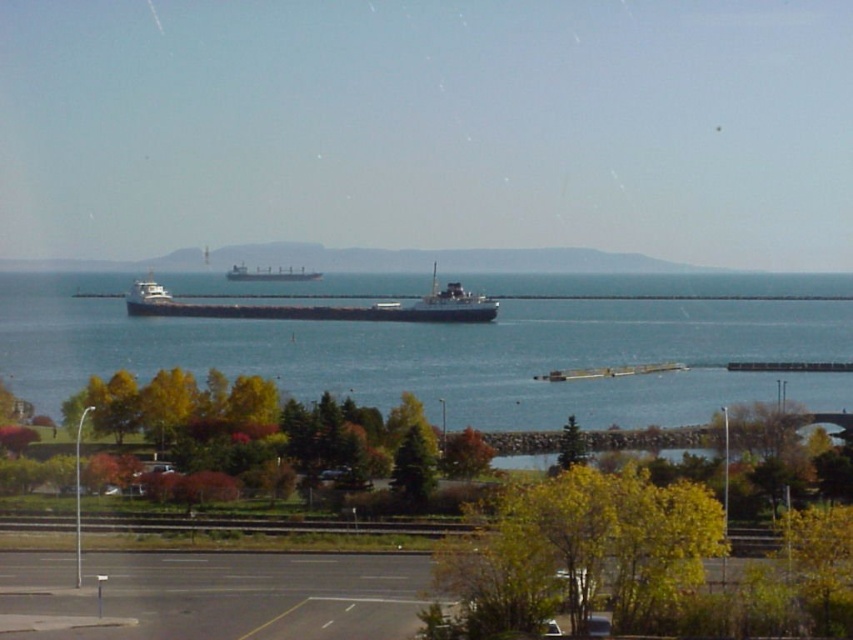
Is blue water at center taller than matte black ship at center?

Yes.

Can you confirm if blue water at center is positioned to the left of matte black ship at center?

No, blue water at center is not to the left of matte black ship at center.

Where is `blue water at center`? blue water at center is located at coordinates (430, 353).

The width and height of the screenshot is (853, 640). Identify the location of blue water at center. (430, 353).

Does point (653, 419) come behind point (254, 268)?

No, (653, 419) is in front of (254, 268).

Between blue water at center and matte black cargo ship at center, which one appears on the right side from the viewer's perspective?

blue water at center

Which is in front, point (108, 356) or point (316, 275)?

Positioned in front is point (108, 356).

Where is `blue water at center`? The height and width of the screenshot is (640, 853). blue water at center is located at coordinates (430, 353).

Who is taller, matte black ship at center or matte black cargo ship at center?

matte black ship at center

Image resolution: width=853 pixels, height=640 pixels. I want to click on matte black ship at center, so click(x=322, y=307).